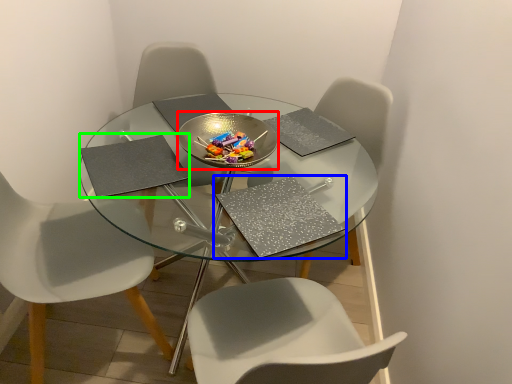
Question: Which object is the farthest from glass plate (highlighted by a red box)? Choose among these: pad (highlighted by a blue box) or pad (highlighted by a green box).

Choices:
 (A) pad
 (B) pad

Answer: (A)